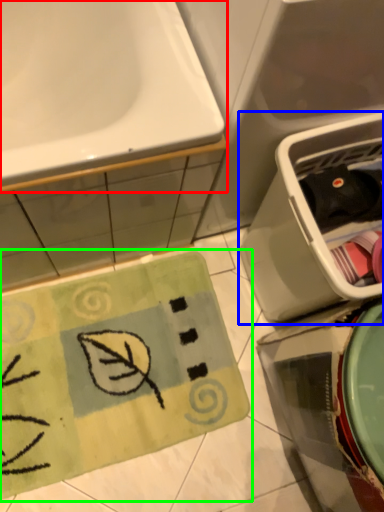
Question: Which is farther away from sink (highlighted by a red box)? dish washer (highlighted by a blue box) or doormat (highlighted by a green box)?

Choices:
 (A) dish washer
 (B) doormat

Answer: (B)